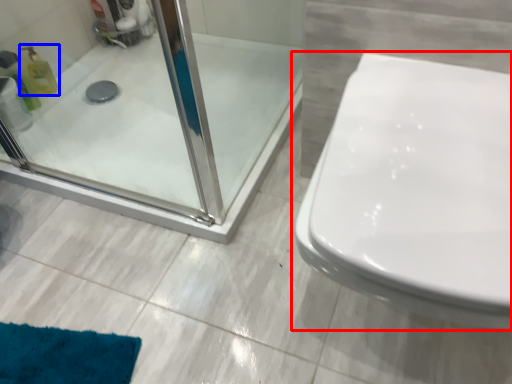
Question: Which object is further to the camera taking this photo, toilet (highlighted by a red box) or cleaning product (highlighted by a blue box)?

Choices:
 (A) toilet
 (B) cleaning product

Answer: (B)